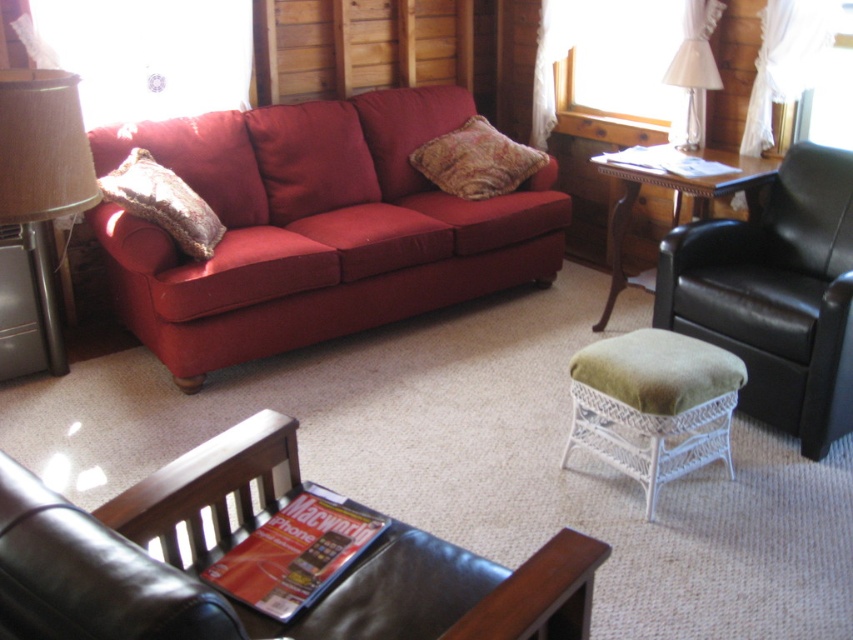
Question: Which point is closer to the camera?

Choices:
 (A) matte red couch at center
 (B) orange glossy magazine at lower center
 (C) wooden table at center right

Answer: (B)

Question: Can you confirm if matte red couch at center is positioned below patterned fabric pillow at center?

Choices:
 (A) no
 (B) yes

Answer: (B)

Question: Is burlap lampshade at left positioned in front of patterned fabric pillow at center?

Choices:
 (A) no
 (B) yes

Answer: (B)

Question: Estimate the real-world distances between objects in this image. Which object is closer to the suede-like brown pillow at left?

Choices:
 (A) matte red couch at center
 (B) white wicker stool at center

Answer: (A)

Question: Where is white wicker stool at center located in relation to burlap lampshade at left in the image?

Choices:
 (A) above
 (B) below

Answer: (B)

Question: Which point appears closest to the camera in this image?

Choices:
 (A) (692, 61)
 (B) (605, 316)
 (C) (51, 355)

Answer: (C)